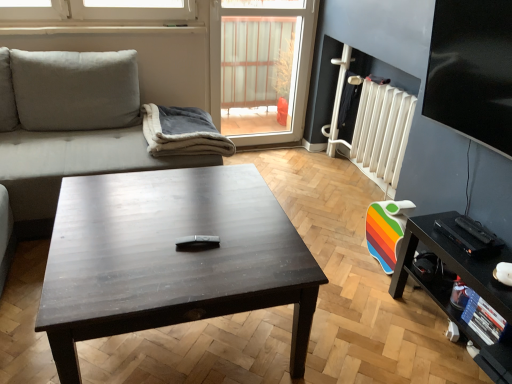
Question: Should I look upward or downward to see transparent plastic window screen at upper center, placed as the 2th window screen when sorted from right to left?

Choices:
 (A) up
 (B) down

Answer: (A)

Question: Considering the relative sizes of suede-like beige couch at left and black glossy tv stand at lower right in the image provided, is suede-like beige couch at left shorter than black glossy tv stand at lower right?

Choices:
 (A) yes
 (B) no

Answer: (B)

Question: Does suede-like beige couch at left have a greater width compared to black glossy tv stand at lower right?

Choices:
 (A) yes
 (B) no

Answer: (A)

Question: Does suede-like beige couch at left appear on the right side of black glossy tv stand at lower right?

Choices:
 (A) no
 (B) yes

Answer: (A)

Question: Does suede-like beige couch at left lie behind black glossy tv stand at lower right?

Choices:
 (A) yes
 (B) no

Answer: (A)

Question: Does suede-like beige couch at left have a lesser width compared to black glossy tv stand at lower right?

Choices:
 (A) no
 (B) yes

Answer: (A)

Question: Can you confirm if suede-like beige couch at left is bigger than black glossy tv stand at lower right?

Choices:
 (A) yes
 (B) no

Answer: (A)

Question: Is white plastic radiator at right facing towards transparent plastic window screen at upper center, which appears as the 1th window screen when viewed from the left?

Choices:
 (A) yes
 (B) no

Answer: (B)

Question: Is transparent plastic window screen at upper center, placed as the first window screen when sorted from back to front, surrounded by white plastic radiator at right?

Choices:
 (A) no
 (B) yes

Answer: (A)

Question: Is white plastic radiator at right positioned beyond the bounds of transparent plastic window screen at upper center, which appears as the 1th window screen when viewed from the left?

Choices:
 (A) no
 (B) yes

Answer: (B)

Question: Is the position of white plastic radiator at right more distant than that of transparent plastic window screen at upper center, placed as the first window screen when sorted from back to front?

Choices:
 (A) no
 (B) yes

Answer: (A)

Question: Is white plastic radiator at right bigger than transparent plastic window screen at upper center, which appears as the 1th window screen when viewed from the left?

Choices:
 (A) no
 (B) yes

Answer: (A)

Question: From the image's perspective, is white plastic radiator at right under transparent plastic window screen at upper center, marked as the 2th window screen in a front-to-back arrangement?

Choices:
 (A) yes
 (B) no

Answer: (A)

Question: Is gray fleece blanket at center next to black glossy tv stand at lower right and touching it?

Choices:
 (A) no
 (B) yes

Answer: (A)